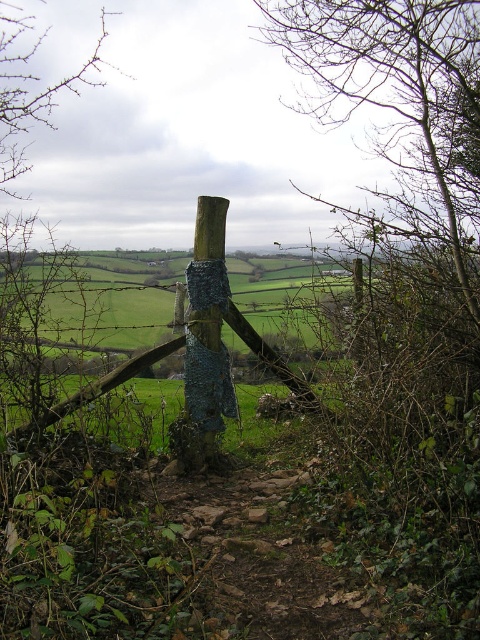
You are a bird flying over the countryside and want to land near the blue knitted fabric at center. Which direction should you head from the bare branches at upper left?

The blue knitted fabric at center is located below the bare branches at upper left, so you should head downward from the bare branches at upper left to reach it.

You are standing at the center of the image and see the point marked at coordinate (207, 330). Which object is this point located on?

The point marked at coordinate (207, 330) is located on the blue knitted fabric at center.

You are a hiker who wants to take a photo of the blue knitted fabric at center and the bare branches at upper left. Which object should you focus on first if you want to capture both in a single frame without moving the camera?

The blue knitted fabric at center is smaller in size compared to the bare branches at upper left, so you should focus on the blue knitted fabric at center first to ensure it is clearly visible in the frame.